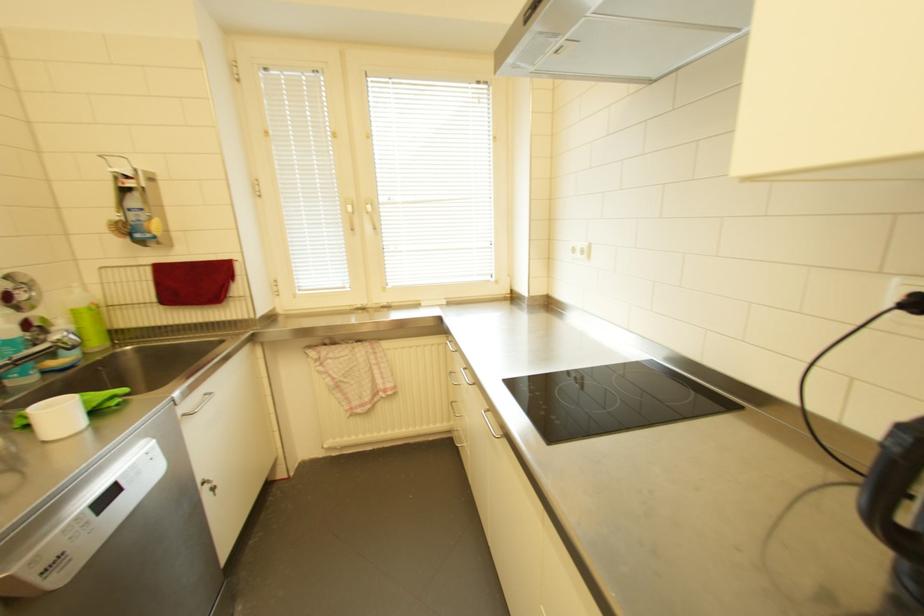
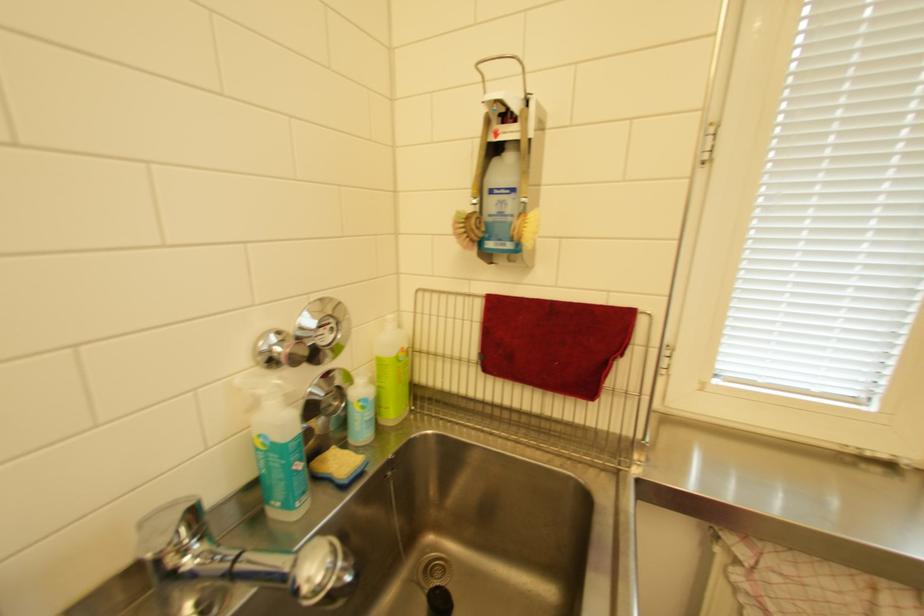
The point at (125, 224) is marked in the first image. Where is the corresponding point in the second image?

(475, 217)